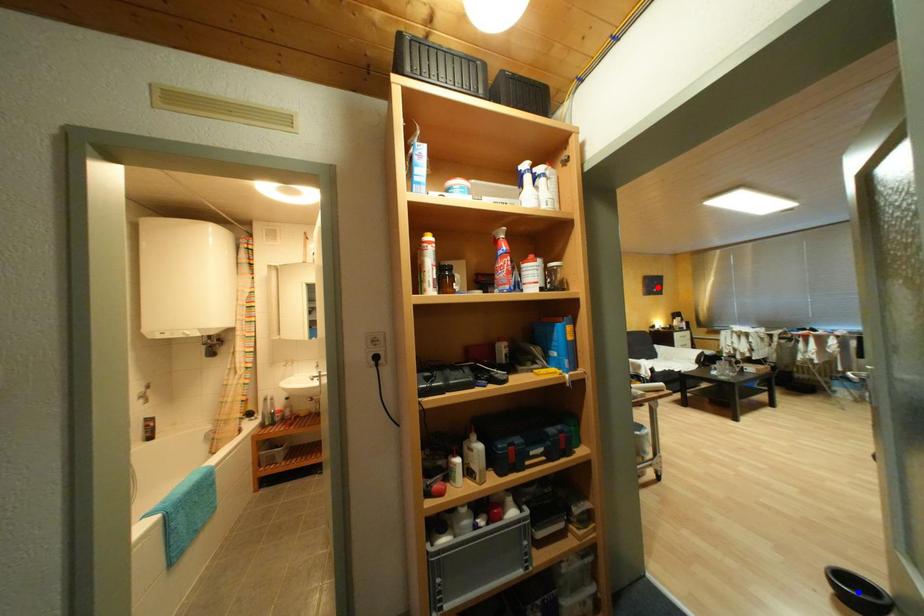
Question: Which of the two points in the image is closer to the camera?

Choices:
 (A) Blue point is closer.
 (B) Red point is closer.

Answer: (A)